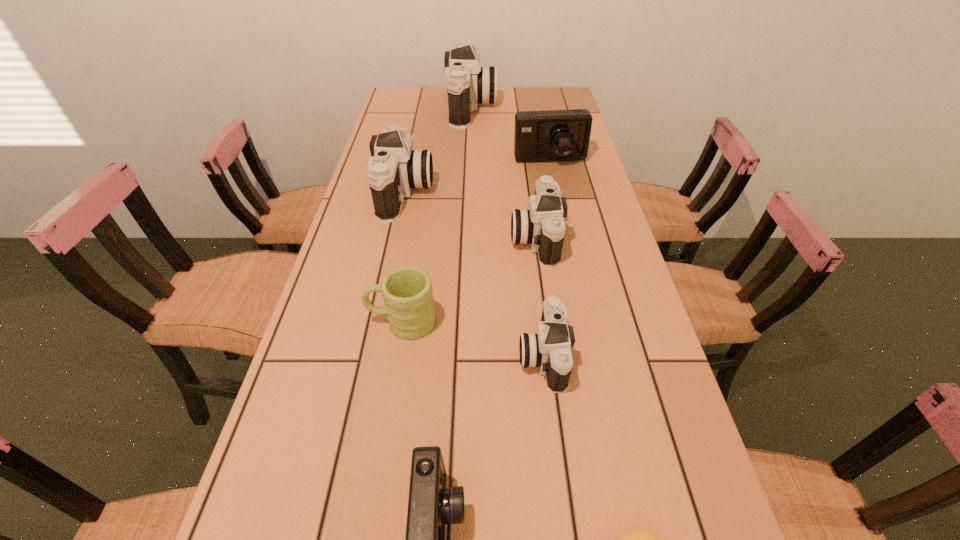
Locate an element on the screen. The width and height of the screenshot is (960, 540). the farthest black camera is located at coordinates (468, 83).

In order to click on the tallest object in this screenshot , I will do `click(468, 83)`.

This screenshot has width=960, height=540. In order to click on the seventh shortest object in this screenshot , I will do `click(395, 169)`.

In order to click on the leftmost black camera in this screenshot , I will do `click(395, 169)`.

Locate an element on the screen. the farther blue camera is located at coordinates (552, 135).

Find the location of `the bigger blue camera`. the bigger blue camera is located at coordinates (552, 135).

Identify the location of the second smallest black camera. (542, 226).

At what (x,y) coordinates should I click in order to perform the action: click on green mug. Please return your answer as a coordinate pair (x, y). This screenshot has width=960, height=540. Looking at the image, I should click on (407, 291).

Locate an element on the screen. The image size is (960, 540). the nearest black camera is located at coordinates (550, 349).

In order to click on the smallest black camera in this screenshot , I will do `click(550, 349)`.